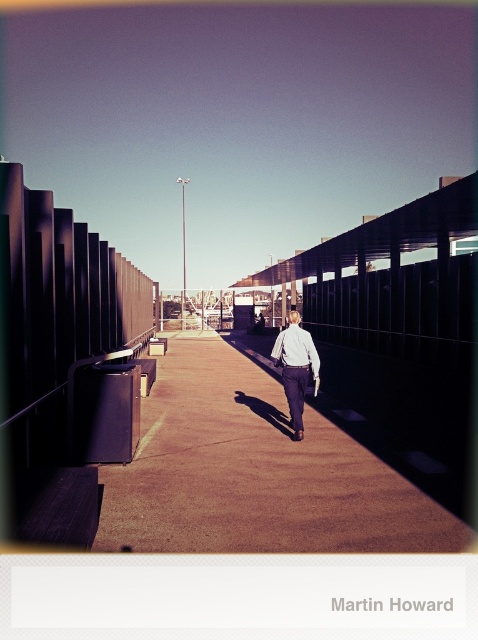
You are observing a person walking down a narrow pathway flanked by dark structures. You notice two white shirts on the person. The first is labeled as white shirt at center and the second as white matte shirt at center. According to the scene, which of these is positioned higher?

The white shirt at center is positioned higher than the white matte shirt at center.

You are standing at the starting point of the pathway and see the brown concrete pavement at center and the white matte shirt at center. Which object is closer to you?

The white matte shirt at center is closer to you because the brown concrete pavement at center is positioned under it, indicating the shirt is above the pavement.